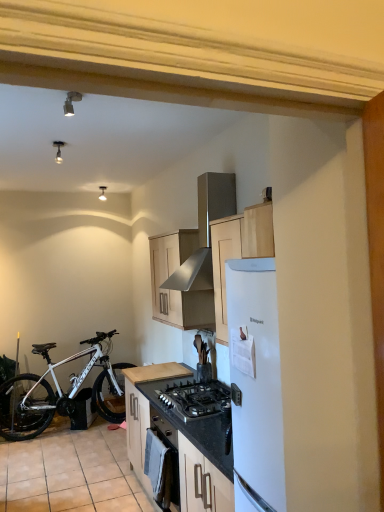
How much space does light wood cabinet at center, marked as the 1th cabinetry in a bottom-to-top arrangement, occupy horizontally?

The width of light wood cabinet at center, marked as the 1th cabinetry in a bottom-to-top arrangement, is 24.80 inches.

What is the approximate height of white matte bicycle at lower left?

It is 1.06 meters.

The width and height of the screenshot is (384, 512). I want to click on white matte bicycle at lower left, so click(60, 391).

The width and height of the screenshot is (384, 512). I want to click on matte wood cabinet at center, positioned as the 1th cabinetry in top-to-bottom order, so click(177, 289).

Considering the points (131, 423) and (65, 415), which point is in front, point (131, 423) or point (65, 415)?

The point (131, 423) is closer to the camera.

Is light wood cabinet at center, marked as the 1th cabinetry in a bottom-to-top arrangement, to the left or to the right of white matte bicycle at lower left in the image?

Based on their positions, light wood cabinet at center, marked as the 1th cabinetry in a bottom-to-top arrangement, is located to the right of white matte bicycle at lower left.

Is light wood cabinet at center, marked as the 1th cabinetry in a bottom-to-top arrangement, outside of white matte bicycle at lower left?

Yes, light wood cabinet at center, marked as the 1th cabinetry in a bottom-to-top arrangement, is located beyond the bounds of white matte bicycle at lower left.

Which object is more forward, light wood cabinet at center, marked as the 1th cabinetry in a bottom-to-top arrangement, or white matte bicycle at lower left?

light wood cabinet at center, marked as the 1th cabinetry in a bottom-to-top arrangement.

Is matte silver light fixture at upper center oriented towards matte wood cabinet at center, positioned as the 1th cabinetry in top-to-bottom order?

No, matte silver light fixture at upper center is not turned towards matte wood cabinet at center, positioned as the 1th cabinetry in top-to-bottom order.

Is point (102, 186) more distant than point (159, 318)?

Yes, it is behind point (159, 318).

Does matte silver light fixture at upper center contain matte wood cabinet at center, positioned as the 1th cabinetry in top-to-bottom order?

No, matte wood cabinet at center, positioned as the 1th cabinetry in top-to-bottom order, is located outside of matte silver light fixture at upper center.

Between matte silver light fixture at upper center and matte wood cabinet at center, which is counted as the 2th cabinetry, starting from the bottom, which one has more height?

matte wood cabinet at center, which is counted as the 2th cabinetry, starting from the bottom.

Is matte wood cabinet at center, which is counted as the 2th cabinetry, starting from the bottom, shorter than matte silver light fixture at upper center?

No, matte wood cabinet at center, which is counted as the 2th cabinetry, starting from the bottom, is not shorter than matte silver light fixture at upper center.

Would you consider matte wood cabinet at center, positioned as the 1th cabinetry in top-to-bottom order, to be distant from matte silver light fixture at upper center?

matte wood cabinet at center, positioned as the 1th cabinetry in top-to-bottom order, is positioned a significant distance from matte silver light fixture at upper center.

Where is `cabinetry that is the 2nd object to the right of the matte silver light fixture at upper center, starting at the anchor`? cabinetry that is the 2nd object to the right of the matte silver light fixture at upper center, starting at the anchor is located at coordinates (177, 289).

Does matte silver light fixture at upper center touch black matte oven at center?

No, matte silver light fixture at upper center is not beside black matte oven at center.

This screenshot has width=384, height=512. Identify the location of oven located on the right of matte silver light fixture at upper center. (162, 462).

Considering the sizes of objects matte silver light fixture at upper center and black matte oven at center in the image provided, who is thinner, matte silver light fixture at upper center or black matte oven at center?

With smaller width is black matte oven at center.

Is point (102, 196) positioned behind point (151, 440)?

Yes, point (102, 196) is behind point (151, 440).

From a real-world perspective, which is physically below, stainless steel range hood at upper center or white matte bicycle at lower left?

white matte bicycle at lower left is physically lower.

In the scene shown: Considering the relative sizes of stainless steel range hood at upper center and white matte bicycle at lower left in the image provided, is stainless steel range hood at upper center taller than white matte bicycle at lower left?

No.

Does stainless steel range hood at upper center turn towards white matte bicycle at lower left?

No, stainless steel range hood at upper center does not turn towards white matte bicycle at lower left.

The image size is (384, 512). Identify the location of tile that appears below the matte wood cabinet at center, positioned as the 1th cabinetry in top-to-bottom order (from a real-world perspective). (70, 473).

Considering the sizes of matte wood cabinet at center, positioned as the 1th cabinetry in top-to-bottom order, and beige tile at lower left in the image, is matte wood cabinet at center, positioned as the 1th cabinetry in top-to-bottom order, taller or shorter than beige tile at lower left?

Clearly, matte wood cabinet at center, positioned as the 1th cabinetry in top-to-bottom order, is taller compared to beige tile at lower left.

Would you say matte wood cabinet at center, positioned as the 1th cabinetry in top-to-bottom order, is inside or outside beige tile at lower left?

matte wood cabinet at center, positioned as the 1th cabinetry in top-to-bottom order, is located beyond the bounds of beige tile at lower left.

From the image's perspective, is matte wood cabinet at center, which is counted as the 2th cabinetry, starting from the bottom, above beige tile at lower left?

Yes.

Is beige tile at lower left wider than matte wood cabinet at center, which is counted as the 2th cabinetry, starting from the bottom?

Yes, beige tile at lower left is wider than matte wood cabinet at center, which is counted as the 2th cabinetry, starting from the bottom.

From a real-world perspective, which object stands above the other?

matte wood cabinet at center, which is counted as the 2th cabinetry, starting from the bottom, is physically above.

From the image's perspective, which object appears higher, beige tile at lower left or matte wood cabinet at center, which is counted as the 2th cabinetry, starting from the bottom?

From the image's view, matte wood cabinet at center, which is counted as the 2th cabinetry, starting from the bottom, is above.

Considering the relative sizes of beige tile at lower left and matte wood cabinet at center, positioned as the 1th cabinetry in top-to-bottom order, in the image provided, is beige tile at lower left bigger than matte wood cabinet at center, positioned as the 1th cabinetry in top-to-bottom order,?

No, beige tile at lower left is not bigger than matte wood cabinet at center, positioned as the 1th cabinetry in top-to-bottom order.

In order to click on bicycle located on the left of light wood cabinet at center, marked as the 1th cabinetry in a bottom-to-top arrangement in this screenshot , I will do `click(60, 391)`.

Which cabinetry is the 1st one when counting from the front of the matte silver light fixture at upper center? Please provide its 2D coordinates.

[(177, 289)]

Based on their spatial positions, is black matte oven at center or stainless steel range hood at upper center further from black matte gas stove at center?

stainless steel range hood at upper center lies further to black matte gas stove at center than the other object.

When comparing their distances from black matte gas stove at center, does white matte bicycle at lower left or black matte oven at center seem further?

white matte bicycle at lower left is further to black matte gas stove at center.

Estimate the real-world distances between objects in this image. Which object is further from matte silver light fixture at upper center, white matte bicycle at lower left or stainless steel range hood at upper center?

The object further to matte silver light fixture at upper center is white matte bicycle at lower left.

Looking at the image, which one is located further to black matte gas stove at center, light wood cabinet at center, marked as the 1th cabinetry in a bottom-to-top arrangement, or matte silver light fixture at upper center?

matte silver light fixture at upper center is further to black matte gas stove at center.

From the image, which object appears to be nearer to matte wood cabinet at center, which is counted as the 2th cabinetry, starting from the bottom, light wood cabinet at center, which is the 2th cabinetry from top to bottom, or beige tile at lower left?

Based on the image, light wood cabinet at center, which is the 2th cabinetry from top to bottom, appears to be nearer to matte wood cabinet at center, which is counted as the 2th cabinetry, starting from the bottom.

When comparing their distances from light wood cabinet at center, marked as the 1th cabinetry in a bottom-to-top arrangement, does stainless steel range hood at upper center or black matte oven at center seem closer?

black matte oven at center lies closer to light wood cabinet at center, marked as the 1th cabinetry in a bottom-to-top arrangement, than the other object.

Estimate the real-world distances between objects in this image. Which object is further from beige tile at lower left, black matte oven at center or stainless steel range hood at upper center?

stainless steel range hood at upper center.

From the image, which object appears to be nearer to white matte bicycle at lower left, black matte gas stove at center or beige tile at lower left?

beige tile at lower left lies closer to white matte bicycle at lower left than the other object.

Identify the location of cabinetry located between light wood cabinet at center, which is the 2th cabinetry from top to bottom, and white matte bicycle at lower left in the depth direction. This screenshot has height=512, width=384. (177, 289).

Locate an element on the screen. This screenshot has width=384, height=512. oven situated between beige tile at lower left and light wood cabinet at center, marked as the 1th cabinetry in a bottom-to-top arrangement, from left to right is located at coordinates (162, 462).

The height and width of the screenshot is (512, 384). I want to click on oven situated between beige tile at lower left and black matte gas stove at center from left to right, so click(162, 462).

The image size is (384, 512). In order to click on bicycle positioned between black matte oven at center and matte silver light fixture at upper center from near to far in this screenshot , I will do `click(60, 391)`.